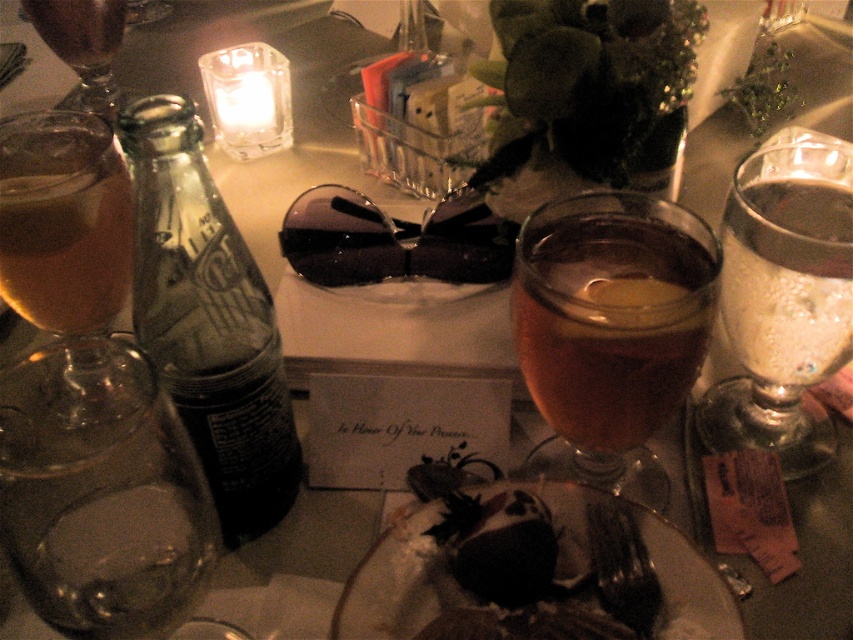
You are a food delivery robot with a 1.5 inch wide arm. You need to place a small dessert between the dark chocolate cake at center and the black plastic fork at lower center. Is there enough space for your arm to maneuver between them?

The distance between the dark chocolate cake at center and the black plastic fork at lower center is 1.20 inches. Since your arm is 1.5 inches wide, it is wider than the available space. Therefore, you cannot maneuver your arm between them.

Consider the image. You are at a dinner party and want to grab a drink. There are two glasses in front of you. The translucent glass at center and the matte glass wine at upper left. Which one is positioned to the right side of the other?

The translucent glass at center is positioned to the right of the matte glass wine at upper left.